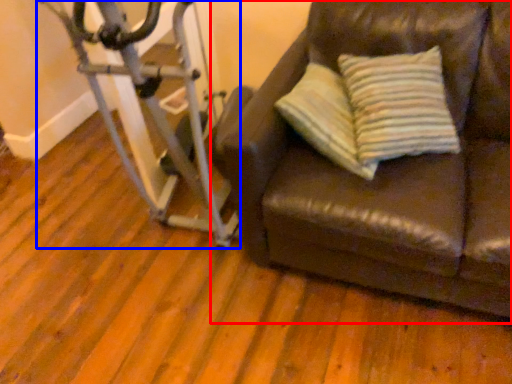
Question: Which object appears farthest to the camera in this image, studio couch (highlighted by a red box) or stationary bicycle (highlighted by a blue box)?

Choices:
 (A) studio couch
 (B) stationary bicycle

Answer: (B)